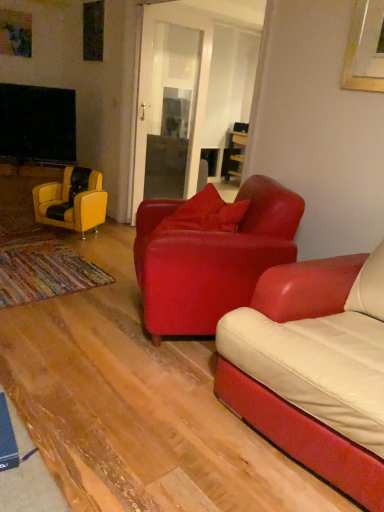
Question: Visually, is leather yellow armchair at left, which is the second chair from front to back, positioned to the left or to the right of satin red armchair at center, acting as the 2th chair starting from the back?

Choices:
 (A) left
 (B) right

Answer: (A)

Question: Which is correct: leather yellow armchair at left, which is the second chair from front to back, is inside satin red armchair at center, arranged as the second chair when viewed from the left, or outside of it?

Choices:
 (A) outside
 (B) inside

Answer: (A)

Question: Considering the positions of leather yellow armchair at left, arranged as the 2th chair when viewed from the right, and satin red armchair at center, the first chair when ordered from right to left, in the image, is leather yellow armchair at left, arranged as the 2th chair when viewed from the right, taller or shorter than satin red armchair at center, the first chair when ordered from right to left,?

Choices:
 (A) tall
 (B) short

Answer: (B)

Question: From the image's perspective, is satin red armchair at center, which is the first chair in front-to-back order, positioned above or below leather yellow armchair at left, arranged as the 2th chair when viewed from the right?

Choices:
 (A) below
 (B) above

Answer: (A)

Question: Relative to leather yellow armchair at left, which is the 1th chair in back-to-front order, is satin red armchair at center, arranged as the second chair when viewed from the left, in front or behind?

Choices:
 (A) front
 (B) behind

Answer: (A)

Question: Is satin red armchair at center, acting as the 2th chair starting from the back, inside or outside of leather yellow armchair at left, arranged as the 2th chair when viewed from the right?

Choices:
 (A) inside
 (B) outside

Answer: (B)

Question: Is satin red armchair at center, arranged as the second chair when viewed from the left, bigger or smaller than leather yellow armchair at left, arranged as the 2th chair when viewed from the right?

Choices:
 (A) small
 (B) big

Answer: (B)